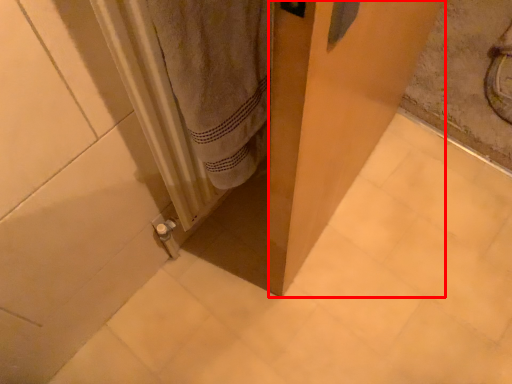
Question: Observing the image, what is the correct spatial positioning of screen door (annotated by the red box) in reference to radiator?

Choices:
 (A) right
 (B) left

Answer: (A)